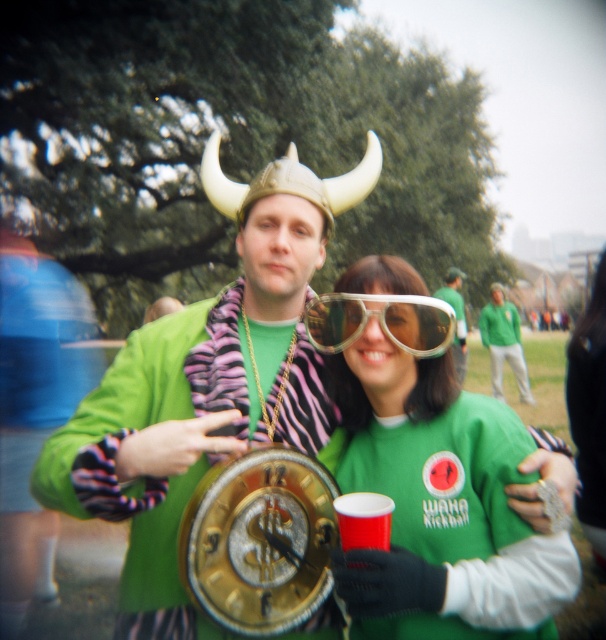
Is green matte shirt at center bigger than gold metallic clock at center?

No.

Looking at this image, which of these two, green matte shirt at center or gold metallic clock at center, stands shorter?

green matte shirt at center

Which is in front, point (355, 381) or point (459, 273)?

Point (355, 381) is in front.

The width and height of the screenshot is (606, 640). In order to click on green matte shirt at center in this screenshot , I will do `click(422, 484)`.

Is green matte shirt at center positioned behind clear plastic goggles at center?

No, green matte shirt at center is closer to the viewer.

How far apart are green matte shirt at center and clear plastic goggles at center?

9.19 inches

Measure the distance between point [510,525] and camera.

Point [510,525] is 1.76 meters from camera.

The image size is (606, 640). In order to click on green matte shirt at center in this screenshot , I will do `click(422, 484)`.

Who is lower down, clear plastic goggles at center or gold metallic clock at center?

gold metallic clock at center is lower down.

Consider the image. Who is higher up, clear plastic goggles at center or gold metallic clock at center?

clear plastic goggles at center

Between point (421, 349) and point (462, 305), which one is positioned in front?

Point (421, 349)

You are a GUI agent. You are given a task and a screenshot of the screen. Output one action in this format:
    pyautogui.click(x=<x>, y=<y>)
    Task: Click on the clear plastic goggles at center
    The image size is (606, 640).
    Given the screenshot: What is the action you would take?
    pyautogui.click(x=381, y=321)